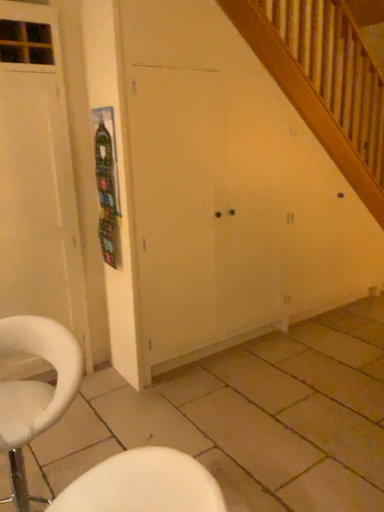
Identify the location of free space between white fabric chair at lower left and white matte cabinet at center. (169, 401).